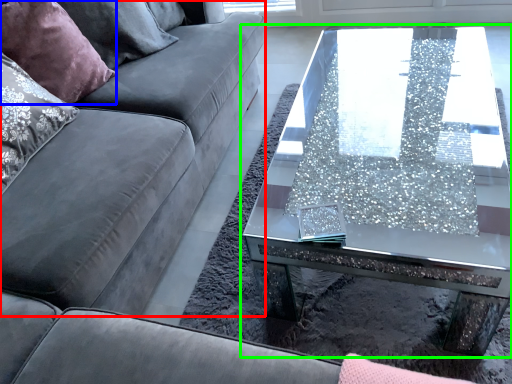
Question: Which object is positioned closest to couch (highlighted by a red box)? Select from pillow (highlighted by a blue box) and coffee table (highlighted by a green box).

Choices:
 (A) pillow
 (B) coffee table

Answer: (A)